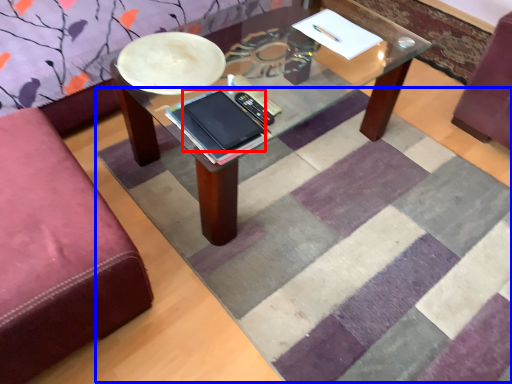
Question: Which point is closer to the camera, tablet computer (highlighted by a red box) or mat (highlighted by a blue box)?

Choices:
 (A) tablet computer
 (B) mat

Answer: (B)